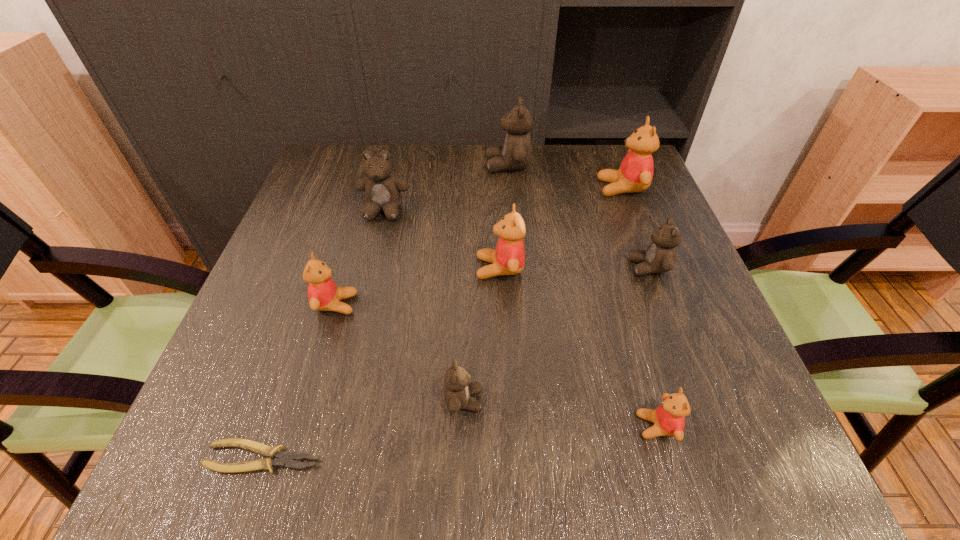
In the image, there is a desktop. In order to click on vacant space at the left edge in this screenshot , I will do `click(318, 313)`.

In the image, there is a desktop. Identify the location of free space at the right edge. (696, 295).

The width and height of the screenshot is (960, 540). In order to click on free space at the far left corner of the desktop in this screenshot , I will do `click(340, 146)`.

In order to click on free space at the near right corner of the desktop in this screenshot , I will do `click(712, 442)`.

This screenshot has width=960, height=540. I want to click on vacant area between the leftmost red teddy bear and the third biggest brown teddy bear, so click(492, 286).

Find the location of a particular element. The image size is (960, 540). vacant space in between the nearest red teddy bear and the second farthest brown teddy bear is located at coordinates (520, 319).

Find the location of a particular element. empty space that is in between the shortest object and the biggest brown teddy bear is located at coordinates (386, 312).

This screenshot has height=540, width=960. What are the coordinates of `free area in between the farthest red teddy bear and the leftmost red teddy bear` in the screenshot? It's located at (479, 246).

Where is `free space between the farthest red teddy bear and the third biggest red teddy bear`? Image resolution: width=960 pixels, height=540 pixels. free space between the farthest red teddy bear and the third biggest red teddy bear is located at coordinates (479, 246).

I want to click on free point between the third brown teddy bear from right to left and the biggest red teddy bear, so click(543, 294).